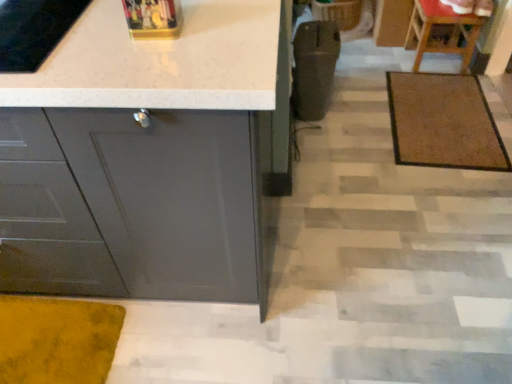
The image size is (512, 384). In order to click on free point above brown textured mat at center right (from a real-world perspective) in this screenshot , I will do `click(443, 112)`.